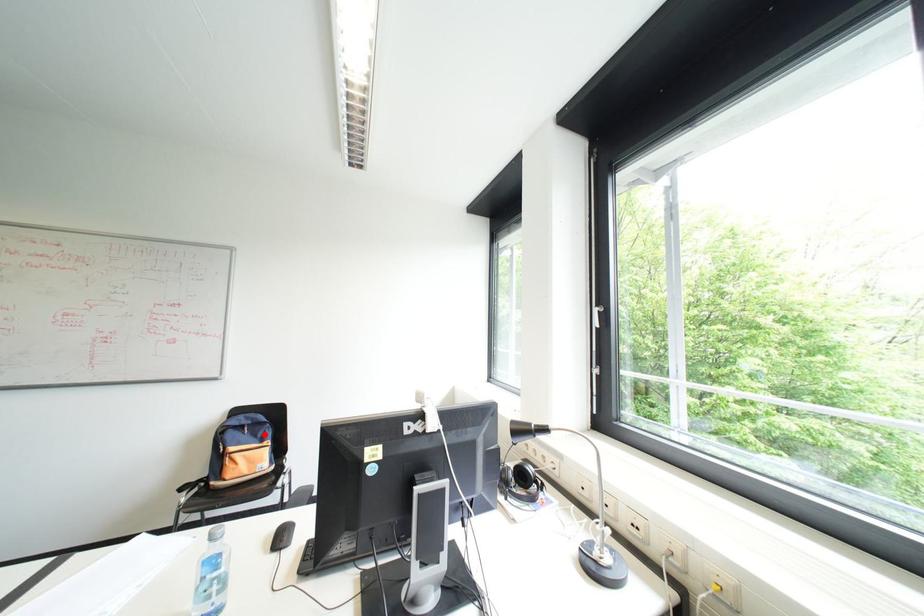
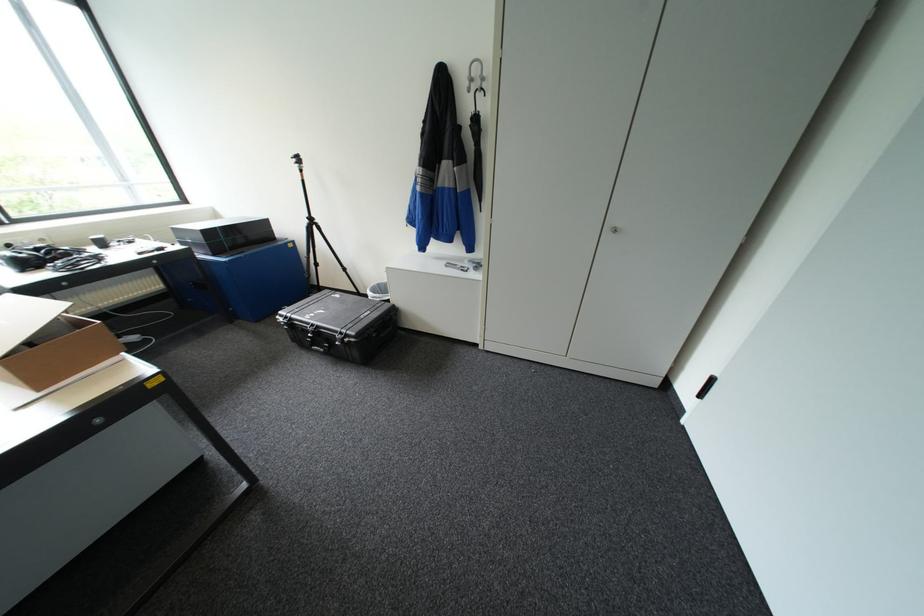
Question: I am providing you with two images of the same scene from different viewpoints. A red point is marked on the first image. At the location where the point appears in image 1, is it still visible in image 2?

Choices:
 (A) Yes
 (B) No

Answer: (B)